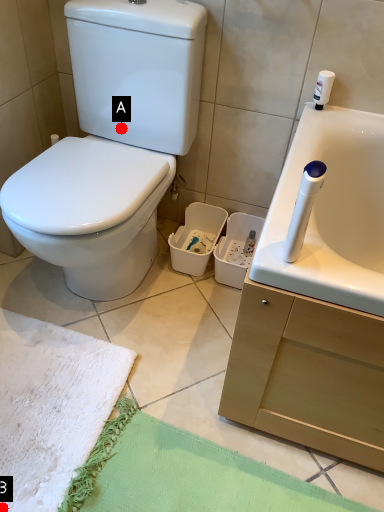
Question: Two points are circled on the image, labeled by A and B beside each circle. Which point appears closest to the camera in this image?

Choices:
 (A) A is closer
 (B) B is closer

Answer: (B)